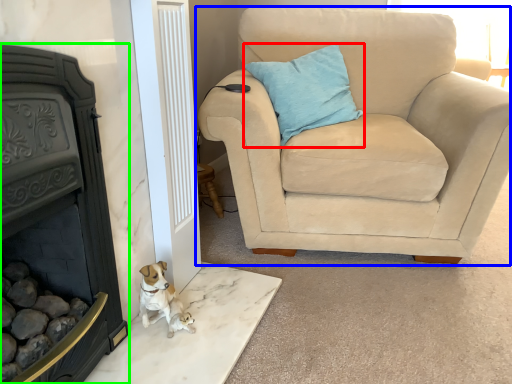
Question: Which is farther away from pillow (highlighted by a red box)? chair (highlighted by a blue box) or fireplace (highlighted by a green box)?

Choices:
 (A) chair
 (B) fireplace

Answer: (B)